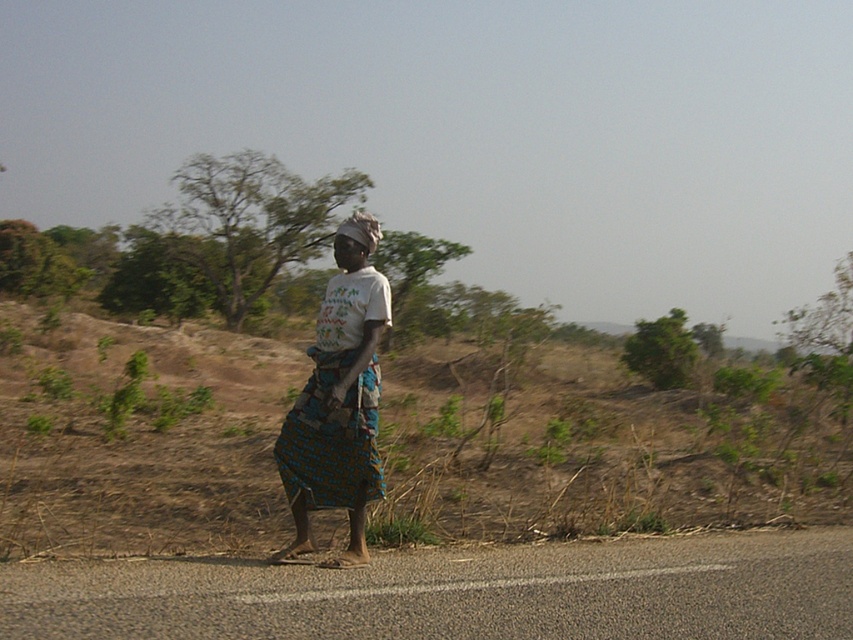
Which is behind, point (294, 502) or point (372, 380)?

Positioned behind is point (294, 502).

Is point (372, 381) positioned behind point (317, 454)?

No.

Find the location of a particular element. printed fabric skirt at center is located at coordinates (338, 401).

Which is more to the left, printed fabric skirt at center or dark brown fabric headscarf at center?

dark brown fabric headscarf at center

Who is more forward, (x=373, y=497) or (x=340, y=268)?

Point (x=373, y=497) is more forward.

Between point (345, 236) and point (350, 246), which one is positioned in front?

Point (345, 236)

You are a GUI agent. You are given a task and a screenshot of the screen. Output one action in this format:
    pyautogui.click(x=<x>, y=<y>)
    Task: Click on the printed fabric skirt at center
    The image size is (853, 640).
    Given the screenshot: What is the action you would take?
    pyautogui.click(x=338, y=401)

Between point (306, 451) and point (350, 248), which one is positioned behind?

The point (306, 451) is more distant.

Does point (288, 481) lie in front of point (372, 244)?

No, it is not.

You are a GUI agent. You are given a task and a screenshot of the screen. Output one action in this format:
    pyautogui.click(x=<x>, y=<y>)
    Task: Click on the blue printed fabric dress at center
    The height and width of the screenshot is (640, 853).
    Given the screenshot: What is the action you would take?
    pyautogui.click(x=332, y=436)

I want to click on blue printed fabric dress at center, so click(x=332, y=436).